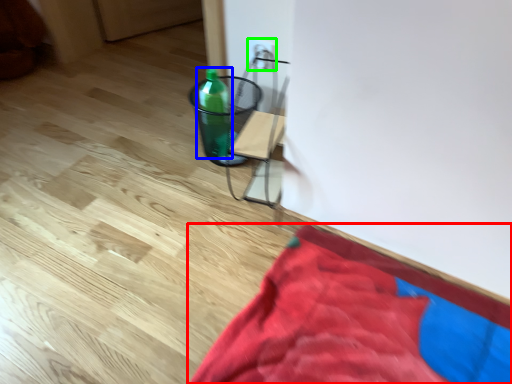
Question: Considering the real-world distances, which object is closest to blanket (highlighted by a red box)? bottle (highlighted by a blue box) or electric outlet (highlighted by a green box).

Choices:
 (A) bottle
 (B) electric outlet

Answer: (A)